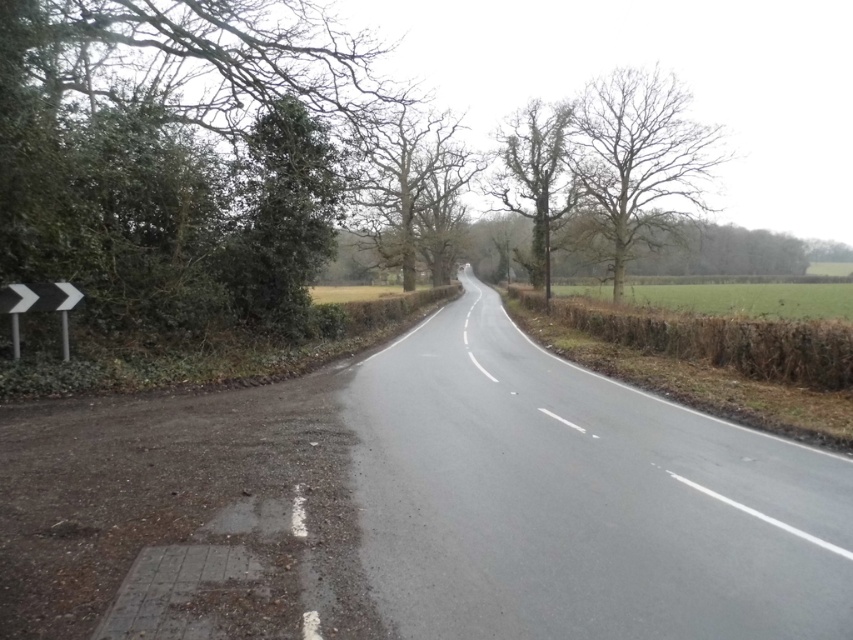
You are driving a car and need to decide whether to pass between the green leafy tree at center and the white plastic arrow at left. Can your car fit through the space between them?

The green leafy tree at center is wider than the white plastic arrow at left. However, the exact distance between them isn not specified in the provided information. Without knowing the actual space between the two objects, it is impossible to determine if the car can fit through.

You are a driver approaching the intersection and need to decide whether to stop or proceed. You see a bare wood tree at upper right and a white plastic arrow at left. Which object is taller and might block your view of oncoming traffic?

The bare wood tree at upper right is taller than the white plastic arrow at left, so it might block your view more effectively.